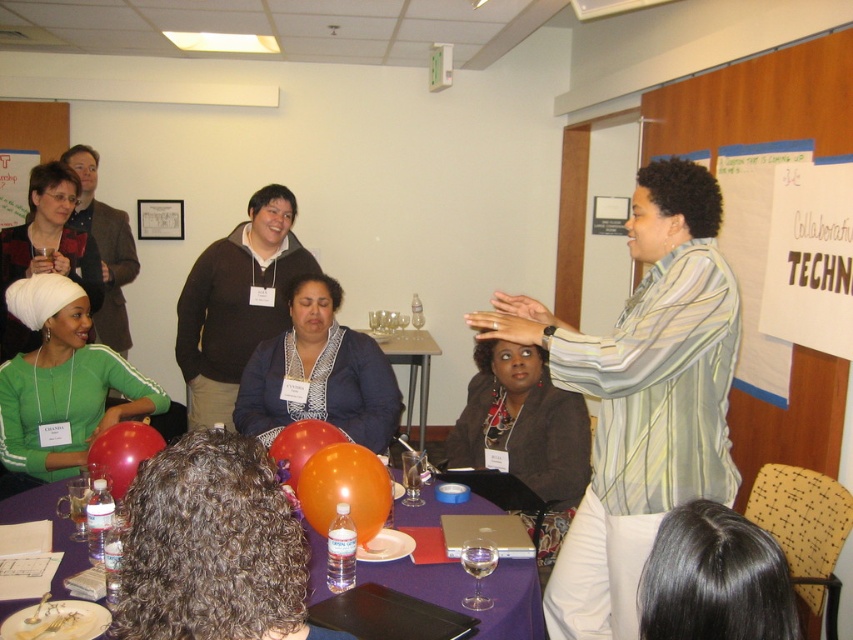
You are organizing a photo shoot in this room and need to position a spotlight at the exact center of the room. The spotlight has a narrow beam that can only illuminate objects within a 0.1 unit radius. Given the coordinates provided for the matte black jacket at center, will the spotlight illuminate it?

The matte black jacket at center is located at point (523, 440). Since the spotlight can only illuminate objects within a 0.1 unit radius from the center, and the jacket is at (523, 440), which is outside the 0.1 radius from the center point, the spotlight will not illuminate it.

You are organizing a photo shoot and need to place a 1.2 meter wide backdrop behind the brown sweater at center and the matte green shirt at lower left. Given their sizes, which object requires a wider portion of the backdrop to accommodate its width?

The brown sweater at center requires a wider portion of the backdrop because its width is larger than the matte green shirt at lower left.